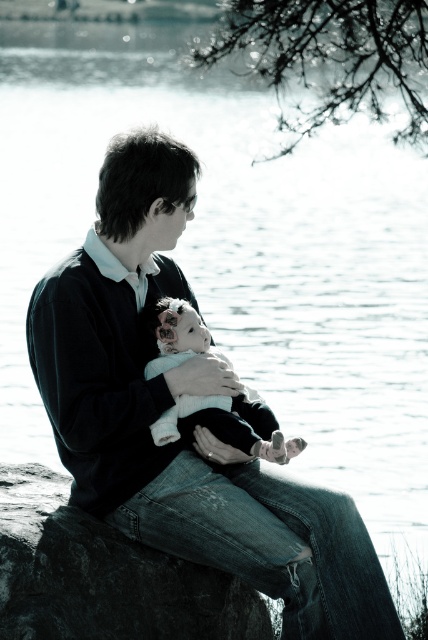
You are a photographer standing in the scene and want to take a photo of the dark blue jeans at center and the dark gray rock at lower left. Which object is closer to your camera lens?

The dark blue jeans at center is further to the viewer than the dark gray rock at lower left, so the dark blue jeans at center is closer to the camera lens.

You are standing at the center of the image and want to place a small item exactly at the coordinates given for the dark blue jeans at center. Is this location on the water or on the shore?

The dark blue jeans at center is located at point (169,404), which is on the shore since the jeans are part of the person sitting by the water, not in it.

You are a photographer trying to capture a closeup shot of the baby in the scene. You have two focus points available at coordinates point (59, 346) and point (183, 340). Which focus point should you choose to ensure the baby is in focus?

You should choose point (59, 346) because it is closer to the camera than point (183, 340), making it better for focusing on the baby.